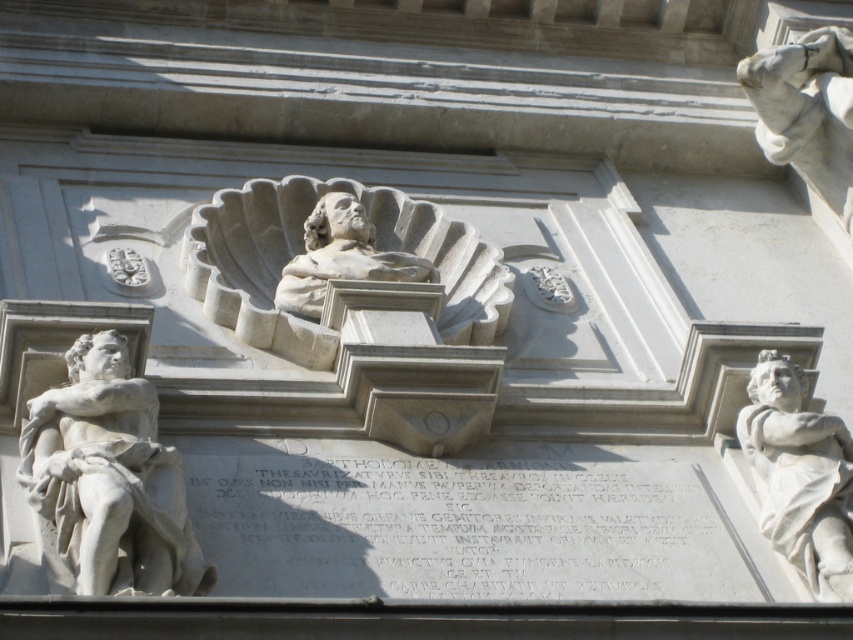
You are an art conservator examining the white marble statue at left and the white marble hand at upper right. Which object would require a larger workspace for restoration due to its size?

The white marble hand at upper right requires a larger workspace because it is bigger than the white marble statue at left.